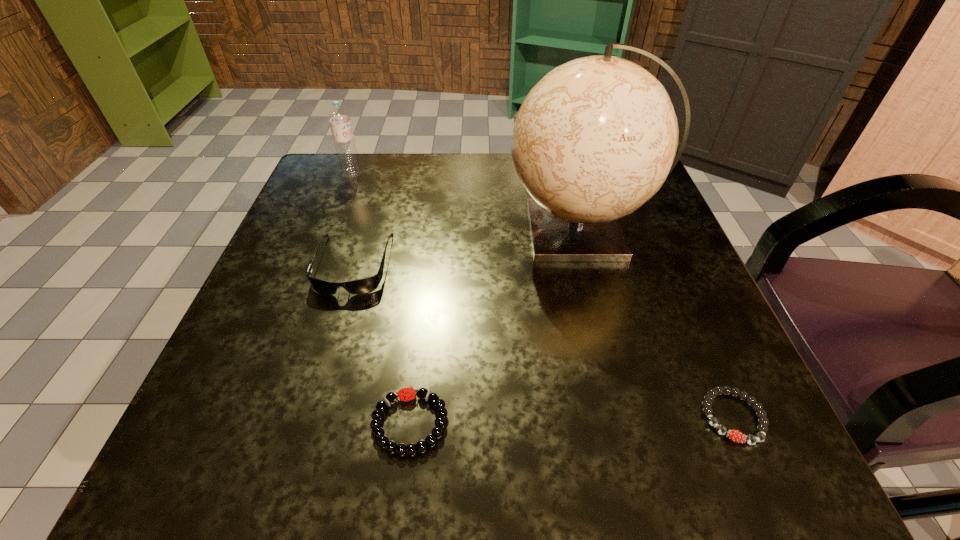
The width and height of the screenshot is (960, 540). Identify the location of vacant area situated on the surface of the tallest object showing Europe and Africa. (387, 231).

The width and height of the screenshot is (960, 540). I want to click on vacant space located on the left of the farthest object, so click(315, 173).

The width and height of the screenshot is (960, 540). I want to click on free region located on the front-facing side of the sunglasses, so click(328, 347).

Find the location of `free space located 0.370m on the right of the taller bracelet`. free space located 0.370m on the right of the taller bracelet is located at coordinates (733, 423).

Find the location of a particular element. This screenshot has width=960, height=540. vacant region located on the left of the right bracelet is located at coordinates (564, 417).

Where is `globe present at the far edge`? globe present at the far edge is located at coordinates (596, 137).

Where is `water bottle positioned at the far edge`? The width and height of the screenshot is (960, 540). water bottle positioned at the far edge is located at coordinates (339, 118).

Find the location of `water bottle present at the left edge`. water bottle present at the left edge is located at coordinates (339, 118).

You are a GUI agent. You are given a task and a screenshot of the screen. Output one action in this format:
    pyautogui.click(x=<x>, y=<y>)
    Task: Click on the sunglasses that is at the left edge
    The width and height of the screenshot is (960, 540).
    Given the screenshot: What is the action you would take?
    pyautogui.click(x=366, y=285)

Find the location of a particular element. Image resolution: width=960 pixels, height=540 pixels. globe present at the right edge is located at coordinates (596, 137).